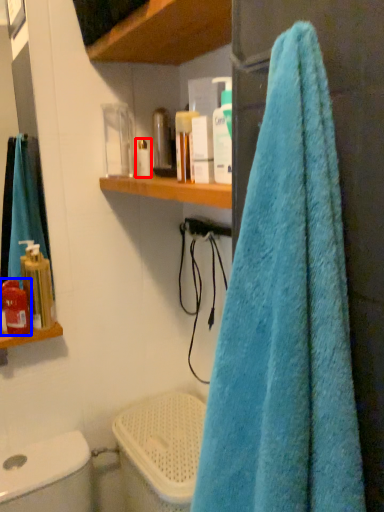
Question: Which of the following is the farthest to the observer, toiletry (highlighted by a red box) or toiletry (highlighted by a blue box)?

Choices:
 (A) toiletry
 (B) toiletry

Answer: (A)